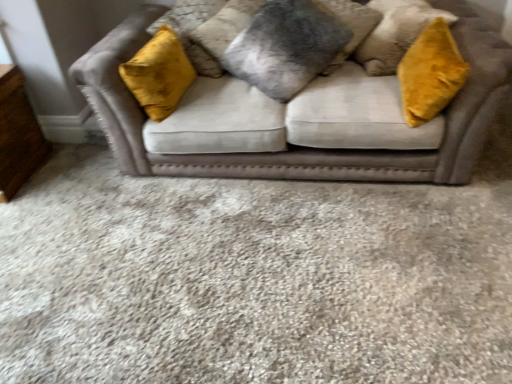
The height and width of the screenshot is (384, 512). Identify the location of wooden dresser at lower left. (17, 134).

In order to face velvet gray pillow at center, placed as the second pillow when sorted from left to right, should I rotate leftwards or rightwards?

A 9.025 degree turn to the right will do.

This screenshot has height=384, width=512. I want to click on velvet beige sofa at center, so click(x=251, y=280).

Locate an element on the screen. The height and width of the screenshot is (384, 512). wooden dresser at lower left is located at coordinates (17, 134).

This screenshot has width=512, height=384. I want to click on dresser lying on the left of velvet gray pillow at center, placed as the second pillow when sorted from left to right, so click(17, 134).

Is wooden dresser at lower left bigger than velvet gray pillow at center, the first pillow viewed from the right?

Incorrect, wooden dresser at lower left is not larger than velvet gray pillow at center, the first pillow viewed from the right.

Relative to velvet gray pillow at center, the first pillow viewed from the right, is wooden dresser at lower left in front or behind?

wooden dresser at lower left is in front of velvet gray pillow at center, the first pillow viewed from the right.

Is velvet beige sofa at center far away from wooden dresser at lower left?

Yes, velvet beige sofa at center and wooden dresser at lower left are located far from each other.

Is velvet beige sofa at center oriented towards wooden dresser at lower left?

No, velvet beige sofa at center is not aimed at wooden dresser at lower left.

Locate an element on the screen. dresser above the velvet beige sofa at center (from the image's perspective) is located at coordinates (17, 134).

Which of these two, velvet beige sofa at center or wooden dresser at lower left, is bigger?

With larger size is velvet beige sofa at center.

Based on their positions, is fuzzy gray pillow at center, which is the second pillow in right-to-left order, located to the left or right of wooden dresser at lower left?

From the image, it's evident that fuzzy gray pillow at center, which is the second pillow in right-to-left order, is to the right of wooden dresser at lower left.

What's the angular difference between fuzzy gray pillow at center, which ranks as the first pillow in left-to-right order, and wooden dresser at lower left's facing directions?

The facing directions of fuzzy gray pillow at center, which ranks as the first pillow in left-to-right order, and wooden dresser at lower left are 22.1 degrees apart.

Is wooden dresser at lower left inside fuzzy gray pillow at center, which ranks as the first pillow in left-to-right order?

No, wooden dresser at lower left is not inside fuzzy gray pillow at center, which ranks as the first pillow in left-to-right order.

Is velvet beige couch at center turned away from velvet beige sofa at center?

No, velvet beige couch at center's orientation is not away from velvet beige sofa at center.

Is velvet beige couch at center inside or outside of velvet beige sofa at center?

velvet beige couch at center is not inside velvet beige sofa at center, it's outside.

Is velvet beige couch at center not close to velvet beige sofa at center?

No, velvet beige couch at center is not far away from velvet beige sofa at center.

From the image's perspective, does velvet beige couch at center appear higher than velvet beige sofa at center?

Yes, from the image's perspective, velvet beige couch at center is over velvet beige sofa at center.

Is wooden dresser at lower left taller than velvet beige couch at center?

Incorrect, the height of wooden dresser at lower left is not larger of that of velvet beige couch at center.

In the scene shown: Could velvet beige couch at center be considered to be inside wooden dresser at lower left?

No, velvet beige couch at center is not inside wooden dresser at lower left.

Is point (4, 198) closer to camera compared to point (135, 148)?

That is False.

From the image's perspective, between wooden dresser at lower left and velvet beige couch at center, which one is located above?

velvet beige couch at center.

From the image's perspective, which one is positioned higher, velvet beige couch at center or wooden dresser at lower left?

velvet beige couch at center is shown above in the image.

From a real-world perspective, is velvet beige couch at center physically located above or below wooden dresser at lower left?

From a real-world perspective, velvet beige couch at center is physically above wooden dresser at lower left.

Is point (505, 44) in front of point (10, 122)?

That is True.

Is velvet beige couch at center facing towards wooden dresser at lower left?

No.

The height and width of the screenshot is (384, 512). I want to click on the 1st pillow above the velvet beige sofa at center (from the image's perspective), so click(214, 30).

From the image's perspective, which one is positioned higher, velvet beige sofa at center or fuzzy gray pillow at center, which is the second pillow in right-to-left order?

fuzzy gray pillow at center, which is the second pillow in right-to-left order.

Who is bigger, velvet beige sofa at center or fuzzy gray pillow at center, which is the second pillow in right-to-left order?

With larger size is velvet beige sofa at center.

Between point (106, 340) and point (195, 31), which one is positioned in front?

Positioned in front is point (106, 340).

What are the coordinates of `dresser lying below the velvet gray pillow at center, placed as the second pillow when sorted from left to right (from the image's perspective)` in the screenshot? It's located at (17, 134).

The height and width of the screenshot is (384, 512). I want to click on plain to the right of wooden dresser at lower left, so click(251, 280).

When comparing their distances from fuzzy gray pillow at center, which is the second pillow in right-to-left order, does wooden dresser at lower left or velvet beige sofa at center seem further?

velvet beige sofa at center is further to fuzzy gray pillow at center, which is the second pillow in right-to-left order.

Considering their positions, is velvet beige sofa at center positioned closer to velvet gray pillow at center, placed as the second pillow when sorted from left to right, than velvet beige couch at center?

velvet beige couch at center.

Based on their spatial positions, is fuzzy gray pillow at center, which is the second pillow in right-to-left order, or velvet gray pillow at center, the first pillow viewed from the right, further from wooden dresser at lower left?

velvet gray pillow at center, the first pillow viewed from the right, is positioned further to the anchor wooden dresser at lower left.

Estimate the real-world distances between objects in this image. Which object is closer to wooden dresser at lower left, velvet gray pillow at center, placed as the second pillow when sorted from left to right, or fuzzy gray pillow at center, which ranks as the first pillow in left-to-right order?

Based on the image, fuzzy gray pillow at center, which ranks as the first pillow in left-to-right order, appears to be nearer to wooden dresser at lower left.

Estimate the real-world distances between objects in this image. Which object is closer to velvet beige sofa at center, fuzzy gray pillow at center, which is the second pillow in right-to-left order, or velvet gray pillow at center, placed as the second pillow when sorted from left to right?

velvet gray pillow at center, placed as the second pillow when sorted from left to right, lies closer to velvet beige sofa at center than the other object.

Estimate the real-world distances between objects in this image. Which object is closer to wooden dresser at lower left, velvet gray pillow at center, the first pillow viewed from the right, or velvet beige couch at center?

velvet beige couch at center is positioned closer to the anchor wooden dresser at lower left.

From the image, which object appears to be farther from velvet beige sofa at center, velvet beige couch at center or fuzzy gray pillow at center, which ranks as the first pillow in left-to-right order?

fuzzy gray pillow at center, which ranks as the first pillow in left-to-right order.

Looking at the image, which one is located closer to fuzzy gray pillow at center, which is the second pillow in right-to-left order, velvet gray pillow at center, the first pillow viewed from the right, or wooden dresser at lower left?

velvet gray pillow at center, the first pillow viewed from the right, is closer to fuzzy gray pillow at center, which is the second pillow in right-to-left order.

Image resolution: width=512 pixels, height=384 pixels. In order to click on studio couch between fuzzy gray pillow at center, which is the second pillow in right-to-left order, and velvet beige sofa at center from top to bottom in this screenshot , I will do `click(298, 117)`.

Identify the location of pillow between wooden dresser at lower left and velvet beige couch at center. The height and width of the screenshot is (384, 512). (214, 30).

Where is `plain between wooden dresser at lower left and velvet gray pillow at center, the first pillow viewed from the right, in the horizontal direction`? plain between wooden dresser at lower left and velvet gray pillow at center, the first pillow viewed from the right, in the horizontal direction is located at coordinates (251, 280).

This screenshot has width=512, height=384. I want to click on pillow between velvet gray pillow at center, placed as the second pillow when sorted from left to right, and velvet beige sofa at center vertically, so click(214, 30).